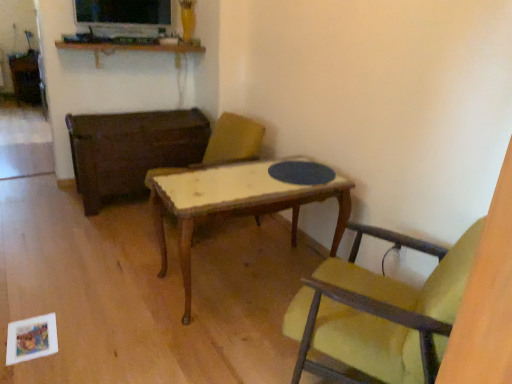
Locate an element on the screen. Image resolution: width=512 pixels, height=384 pixels. wooden textured chair at center, which ranks as the 2th chair in front-to-back order is located at coordinates (223, 145).

What is the approximate width of wooden shelf at upper center?

13.55 inches.

Image resolution: width=512 pixels, height=384 pixels. I want to click on wooden table at center, so click(131, 149).

Who is smaller, yellow fabric chair at center, which is the second chair in back-to-front order, or wooden textured chair at center, the 2th chair in the right-to-left sequence?

yellow fabric chair at center, which is the second chair in back-to-front order, is smaller.

Between point (392, 312) and point (216, 158), which one is positioned behind?

The point (216, 158) is farther.

Relative to wooden textured chair at center, acting as the first chair starting from the left, is yellow fabric chair at center, which is the second chair in back-to-front order, in front or behind?

Visually, yellow fabric chair at center, which is the second chair in back-to-front order, is located in front of wooden textured chair at center, acting as the first chair starting from the left.

Is yellow fabric chair at center, which appears as the 2th chair when viewed from the left, beside wooden textured chair at center, acting as the first chair starting from the left?

yellow fabric chair at center, which appears as the 2th chair when viewed from the left, and wooden textured chair at center, acting as the first chair starting from the left, are clearly separated.

Are wooden shelf at upper center and yellow fabric chair at center, which is the second chair in back-to-front order, far apart?

Yes, wooden shelf at upper center is far from yellow fabric chair at center, which is the second chair in back-to-front order.

From the image's perspective, is wooden shelf at upper center above or below yellow fabric chair at center, acting as the 1th chair starting from the right?

Clearly, from the image's perspective, wooden shelf at upper center is above yellow fabric chair at center, acting as the 1th chair starting from the right.

Is wooden shelf at upper center looking in the opposite direction of yellow fabric chair at center, acting as the 1th chair starting from the right?

No, wooden shelf at upper center is not facing away from yellow fabric chair at center, acting as the 1th chair starting from the right.

Which of these two, wooden shelf at upper center or yellow fabric chair at center, the 1th chair in the front-to-back sequence, is smaller?

wooden shelf at upper center.

Which object is positioned more to the left, yellow fabric chair at center, which is the second chair in back-to-front order, or wooden shelf at upper center?

wooden shelf at upper center.

What's the angular difference between yellow fabric chair at center, which is the second chair in back-to-front order, and wooden shelf at upper center's facing directions?

147 degrees separate the facing orientations of yellow fabric chair at center, which is the second chair in back-to-front order, and wooden shelf at upper center.

Would you say yellow fabric chair at center, which is the second chair in back-to-front order, contains wooden shelf at upper center?

No, yellow fabric chair at center, which is the second chair in back-to-front order, does not contain wooden shelf at upper center.

Considering the sizes of objects yellow fabric chair at center, acting as the 1th chair starting from the right, and wooden shelf at upper center in the image provided, who is bigger, yellow fabric chair at center, acting as the 1th chair starting from the right, or wooden shelf at upper center?

yellow fabric chair at center, acting as the 1th chair starting from the right, is bigger.

Is wooden shelf at upper center completely or partially outside of wooden table at center?

Yes, wooden shelf at upper center is not within wooden table at center.

Is wooden shelf at upper center not near wooden table at center?

Actually, wooden shelf at upper center and wooden table at center are a little close together.

Could you tell me if wooden shelf at upper center is facing wooden table at center?

No, wooden shelf at upper center does not turn towards wooden table at center.

Is wooden textured chair at center, the first chair in the back-to-front sequence, turned away from wooden shelf at upper center?

That's not correct — wooden textured chair at center, the first chair in the back-to-front sequence, is not looking away from wooden shelf at upper center.

Looking at this image, which is more to the left, wooden textured chair at center, acting as the first chair starting from the left, or wooden shelf at upper center?

wooden shelf at upper center.

In the image, is wooden textured chair at center, acting as the first chair starting from the left, positioned in front of or behind wooden shelf at upper center?

wooden textured chair at center, acting as the first chair starting from the left, is positioned closer to the viewer than wooden shelf at upper center.

Which of these two, wooden textured chair at center, which ranks as the 2th chair in front-to-back order, or wooden shelf at upper center, is smaller?

Smaller between the two is wooden shelf at upper center.

Can you confirm if wooden table at center is bigger than yellow fabric chair at center, which appears as the 2th chair when viewed from the left?

Indeed, wooden table at center has a larger size compared to yellow fabric chair at center, which appears as the 2th chair when viewed from the left.

Does point (131, 120) appear closer or farther from the camera than point (327, 313)?

Point (131, 120).

Image resolution: width=512 pixels, height=384 pixels. I want to click on table on the left of yellow fabric chair at center, which appears as the 2th chair when viewed from the left, so click(x=131, y=149).

Between wooden table at center and yellow fabric chair at center, acting as the 1th chair starting from the right, which one is positioned behind?

Positioned behind is wooden table at center.

What's the angular difference between wooden textured chair at center, the first chair in the back-to-front sequence, and yellow fabric chair at center, the 1th chair in the front-to-back sequence,'s facing directions?

62.7 degrees separate the facing orientations of wooden textured chair at center, the first chair in the back-to-front sequence, and yellow fabric chair at center, the 1th chair in the front-to-back sequence.

From the picture: Is wooden textured chair at center, which ranks as the 2th chair in front-to-back order, far from yellow fabric chair at center, the 1th chair in the front-to-back sequence?

That's right, there is a large distance between wooden textured chair at center, which ranks as the 2th chair in front-to-back order, and yellow fabric chair at center, the 1th chair in the front-to-back sequence.

Does wooden textured chair at center, which ranks as the 2th chair in front-to-back order, come in front of yellow fabric chair at center, which appears as the 2th chair when viewed from the left?

No, wooden textured chair at center, which ranks as the 2th chair in front-to-back order, is further to the viewer.

In terms of width, does wooden textured chair at center, the first chair in the back-to-front sequence, look wider or thinner when compared to yellow fabric chair at center, which appears as the 2th chair when viewed from the left?

Clearly, wooden textured chair at center, the first chair in the back-to-front sequence, has more width compared to yellow fabric chair at center, which appears as the 2th chair when viewed from the left.

This screenshot has height=384, width=512. Identify the location of chair behind the yellow fabric chair at center, acting as the 1th chair starting from the right. (223, 145).

Starting from the wooden shelf at upper center, which chair is the 2nd one to the right? Please provide its 2D coordinates.

[(380, 313)]

Which object lies further to the anchor point yellow fabric chair at center, the 1th chair in the front-to-back sequence, wooden shelf at upper center or wooden textured chair at center, which ranks as the 2th chair in front-to-back order?

Based on the image, wooden shelf at upper center appears to be further to yellow fabric chair at center, the 1th chair in the front-to-back sequence.

Based on their spatial positions, is yellow fabric chair at center, acting as the 1th chair starting from the right, or wooden textured chair at center, the first chair in the back-to-front sequence, closer to wooden shelf at upper center?

Based on the image, wooden textured chair at center, the first chair in the back-to-front sequence, appears to be nearer to wooden shelf at upper center.

In the scene shown: From the image, which object appears to be nearer to wooden textured chair at center, which ranks as the 2th chair in front-to-back order, yellow fabric chair at center, acting as the 1th chair starting from the right, or wooden table at center?

wooden table at center.

From the image, which object appears to be farther from wooden table at center, wooden textured chair at center, acting as the first chair starting from the left, or yellow fabric chair at center, which appears as the 2th chair when viewed from the left?

yellow fabric chair at center, which appears as the 2th chair when viewed from the left, is positioned further to the anchor wooden table at center.

Considering their positions, is wooden table at center positioned further to yellow fabric chair at center, which is the second chair in back-to-front order, than wooden shelf at upper center?

wooden shelf at upper center is further to yellow fabric chair at center, which is the second chair in back-to-front order.

Looking at the image, which one is located further to wooden shelf at upper center, wooden textured chair at center, acting as the first chair starting from the left, or yellow fabric chair at center, the 1th chair in the front-to-back sequence?

Among the two, yellow fabric chair at center, the 1th chair in the front-to-back sequence, is located further to wooden shelf at upper center.

Considering their positions, is wooden table at center positioned closer to wooden textured chair at center, which ranks as the 2th chair in front-to-back order, than yellow fabric chair at center, which is the second chair in back-to-front order?

wooden table at center.

Looking at the image, which one is located closer to wooden table at center, yellow fabric chair at center, which is the second chair in back-to-front order, or wooden shelf at upper center?

Among the two, wooden shelf at upper center is located nearer to wooden table at center.

Where is `table between yellow fabric chair at center, acting as the 1th chair starting from the right, and wooden shelf at upper center in the front-back direction`? table between yellow fabric chair at center, acting as the 1th chair starting from the right, and wooden shelf at upper center in the front-back direction is located at coordinates coord(131,149).

The image size is (512, 384). I want to click on table between wooden shelf at upper center and wooden textured chair at center, which ranks as the 2th chair in front-to-back order, in the up-down direction, so click(131, 149).

Where is `chair between yellow fabric chair at center, which appears as the 2th chair when viewed from the left, and wooden shelf at upper center from front to back`? This screenshot has height=384, width=512. chair between yellow fabric chair at center, which appears as the 2th chair when viewed from the left, and wooden shelf at upper center from front to back is located at coordinates (223, 145).

Find the location of a particular element. This screenshot has width=512, height=384. chair positioned between yellow fabric chair at center, acting as the 1th chair starting from the right, and wooden table at center from near to far is located at coordinates (223, 145).